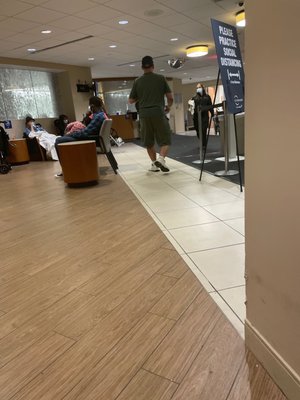
The width and height of the screenshot is (300, 400). What are the coordinates of `ceramic floor tile` in the screenshot? It's located at (228, 235).